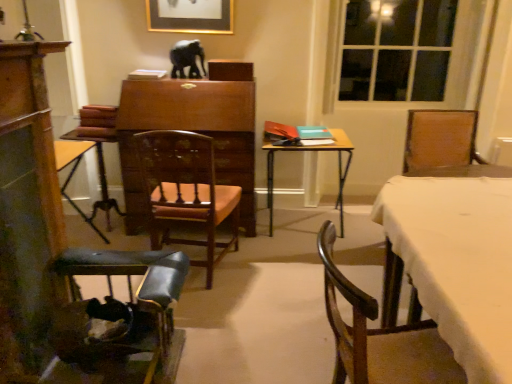
At what (x,y) coordinates should I click in order to perform the action: click on free space above matte gold picture frame at upper center (from a real-world perspective). Please return your answer as a coordinate pair (x, y). Looking at the image, I should click on (185, 1).